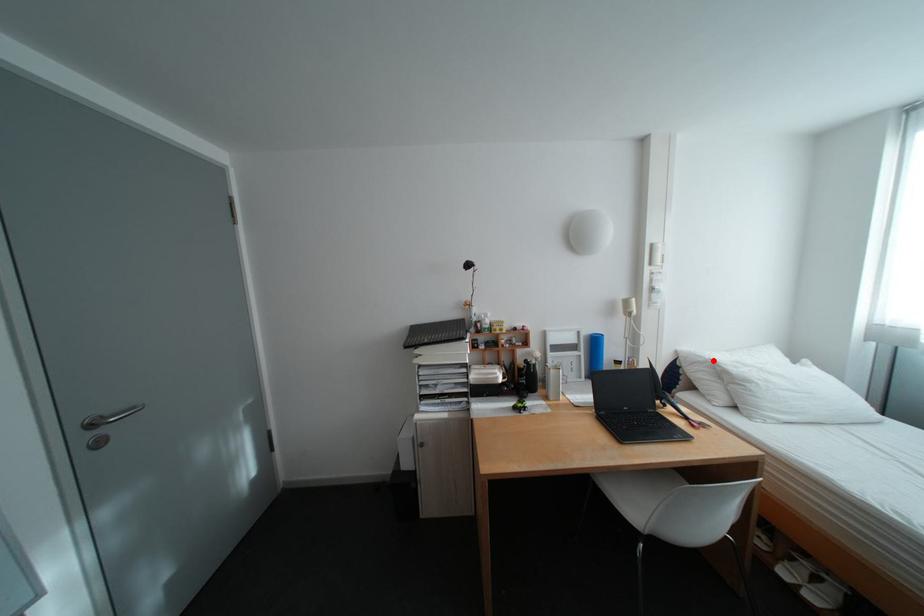
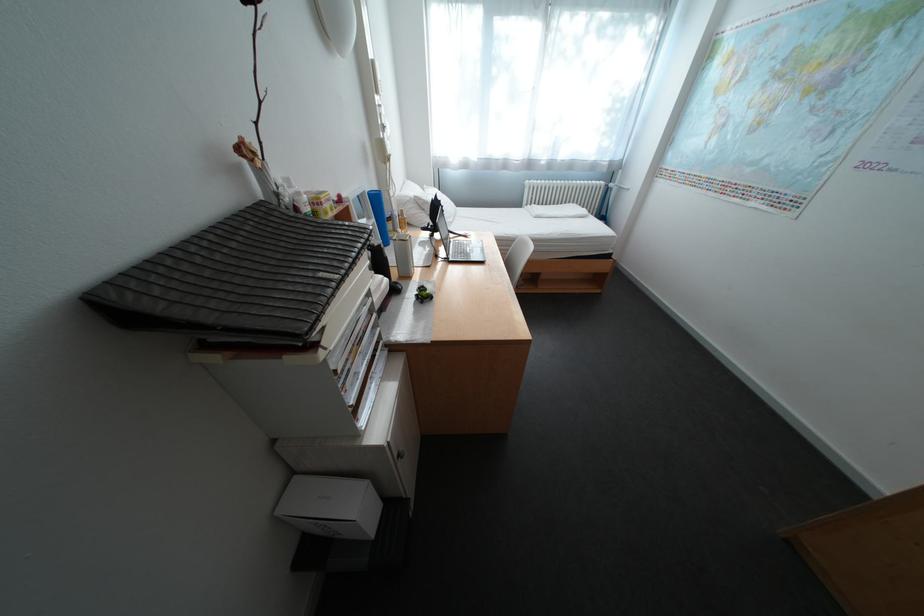
In the second image, find the point that corresponds to the highlighted location in the first image.

(420, 200)